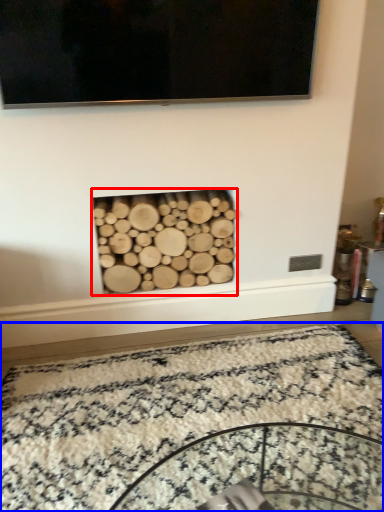
Question: Which of the following is the farthest to the observer, fireplace (highlighted by a red box) or mat (highlighted by a blue box)?

Choices:
 (A) fireplace
 (B) mat

Answer: (A)